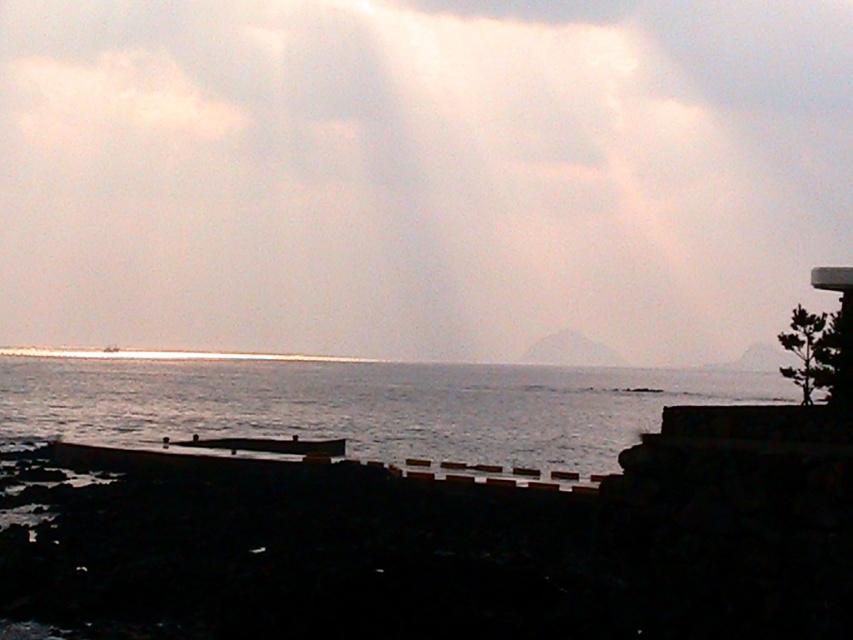
You are a photographer trying to capture the exact position of the white matte cloud at upper center in the coastal scene. According to the coordinates provided, where is the cloud positioned relative to the center of the image?

The white matte cloud at upper center is located at coordinates point (x=421, y=172), which means it is positioned slightly to the left and just below the center of the image.

You are standing on the rocky shoreline and want to take a photo of the white matte cloud at upper center. The camera you have can focus on objects up to 500 feet away. Will the cloud be in focus?

The white matte cloud at upper center is 654.00 feet away from viewer. Since the camera can only focus up to 500 feet, the cloud will be out of focus.